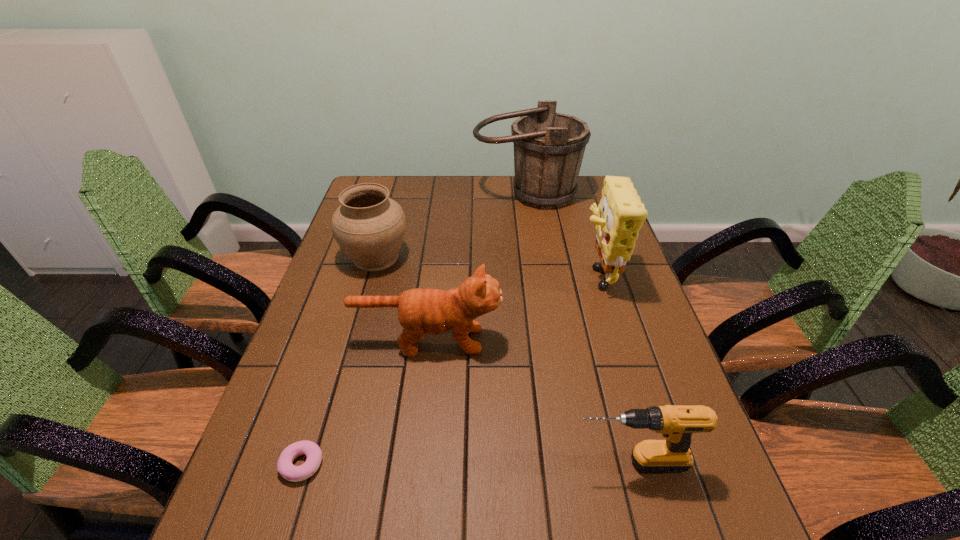
Where is `free location located 0.290m on the face of the cat`? free location located 0.290m on the face of the cat is located at coordinates (616, 340).

Find the location of `vacant region located 0.390m on the back of the urn`. vacant region located 0.390m on the back of the urn is located at coordinates (398, 178).

Locate an element on the screen. The image size is (960, 540). vacant region located 0.190m at the tip of the drill is located at coordinates (475, 462).

Image resolution: width=960 pixels, height=540 pixels. I want to click on free location located 0.380m at the tip of the drill, so click(x=378, y=462).

Where is `vacant space located 0.100m at the tip of the drill`? This screenshot has height=540, width=960. vacant space located 0.100m at the tip of the drill is located at coordinates click(x=520, y=462).

This screenshot has height=540, width=960. Identify the location of blank space located 0.230m on the right of the pastry. (441, 464).

Locate an element on the screen. The height and width of the screenshot is (540, 960). object present at the far edge is located at coordinates (549, 147).

Image resolution: width=960 pixels, height=540 pixels. What are the coordinates of `cat present at the left edge` in the screenshot? It's located at (421, 311).

Where is `urn that is at the left edge`? The image size is (960, 540). urn that is at the left edge is located at coordinates (370, 227).

Where is `pastry that is positioned at the left edge`? The image size is (960, 540). pastry that is positioned at the left edge is located at coordinates (293, 473).